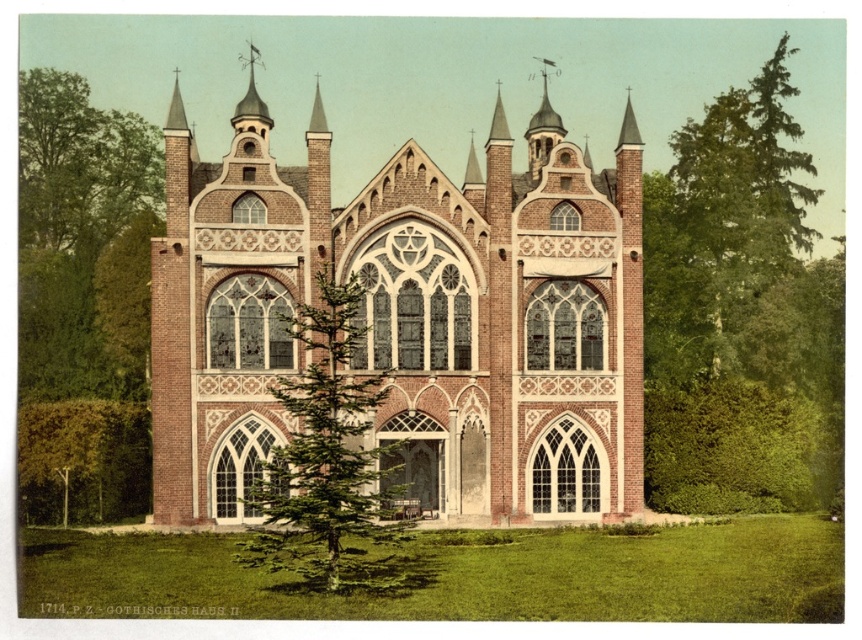
You are standing in front of a Gothic building and notice a brick gothic church at center and a green leafy tree at center. Which one has a greater height?

The brick gothic church at center is much taller than the green leafy tree at center according to the description.

You are standing in front of the brick gothic church at center and want to take a photo of the green leafy tree at left. Since the church is blocking your view, can you move to the right to capture the tree in the frame?

The brick gothic church at center is above the green leafy tree at left, so moving to the right might not help because the church is positioned higher and could still block the view of the tree. You might need to move further back or lower your angle to see around the church.

You are a visitor standing in front of the brick gothic church at center and the green leafy tree at center. Which object appears closer to you?

The brick gothic church at center is positioned over the green leafy tree at center, so it appears closer to you.